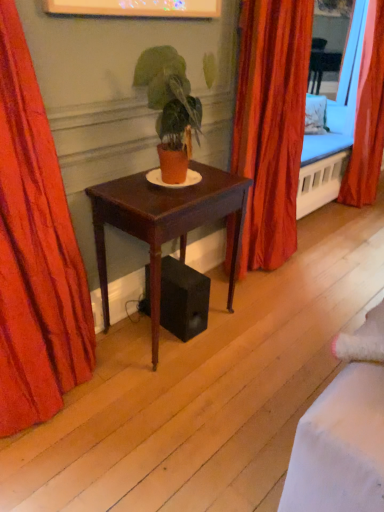
The width and height of the screenshot is (384, 512). Find the location of `free space in front of mahogany wood desk at center`. free space in front of mahogany wood desk at center is located at coordinates coord(175,394).